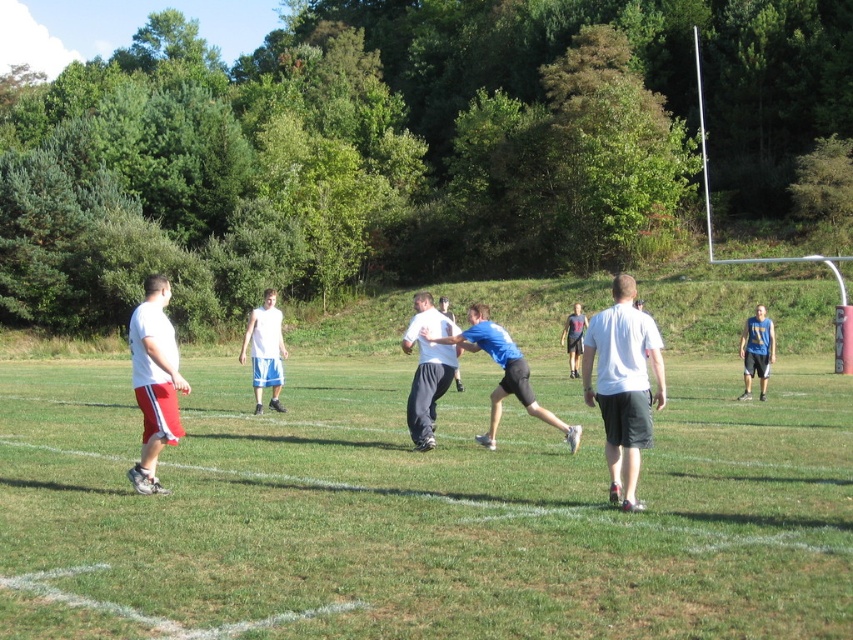
Between blue fabric shirt at center and white matte shorts at center, which one is positioned lower?

white matte shorts at center

Does point (496, 401) come closer to viewer compared to point (241, 358)?

Yes, point (496, 401) is closer to viewer.

At what (x,y) coordinates should I click in order to perform the action: click on blue fabric shirt at center. Please return your answer as a coordinate pair (x, y). Looking at the image, I should click on (503, 372).

Is green grass football field at center thinner than blue t-shirt at center?

No.

The width and height of the screenshot is (853, 640). I want to click on green grass football field at center, so click(422, 509).

Between point (219, 456) and point (566, 342), which one is positioned in front?

Point (219, 456) is more forward.

Find the location of a particular element. This screenshot has height=640, width=853. green grass football field at center is located at coordinates (422, 509).

Is point (805, 369) farther from viewer compared to point (408, 353)?

That is True.

This screenshot has height=640, width=853. What do you see at coordinates (422, 509) in the screenshot? I see `green grass football field at center` at bounding box center [422, 509].

Is point (310, 624) behind point (421, 307)?

No, it is in front of (421, 307).

Identify the location of green grass football field at center. The height and width of the screenshot is (640, 853). (422, 509).